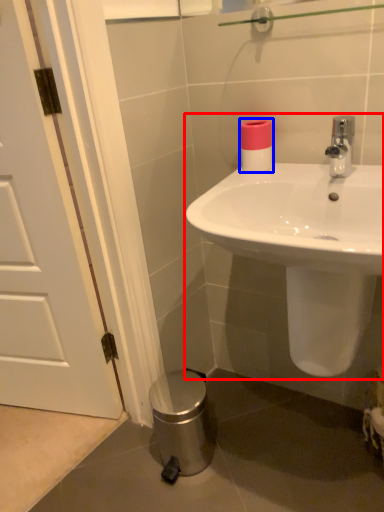
Question: Which point is further to the camera, sink (highlighted by a red box) or toilet paper (highlighted by a blue box)?

Choices:
 (A) sink
 (B) toilet paper

Answer: (B)